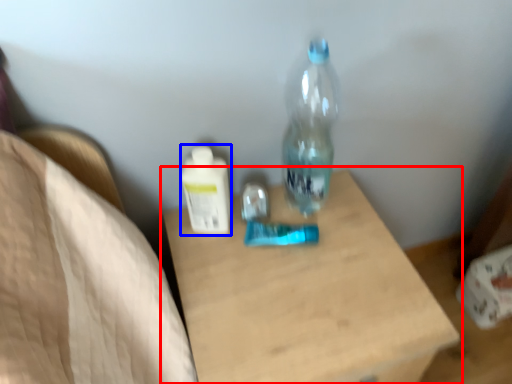
Question: Which object is further to the camera taking this photo, table (highlighted by a red box) or bottle (highlighted by a blue box)?

Choices:
 (A) table
 (B) bottle

Answer: (B)